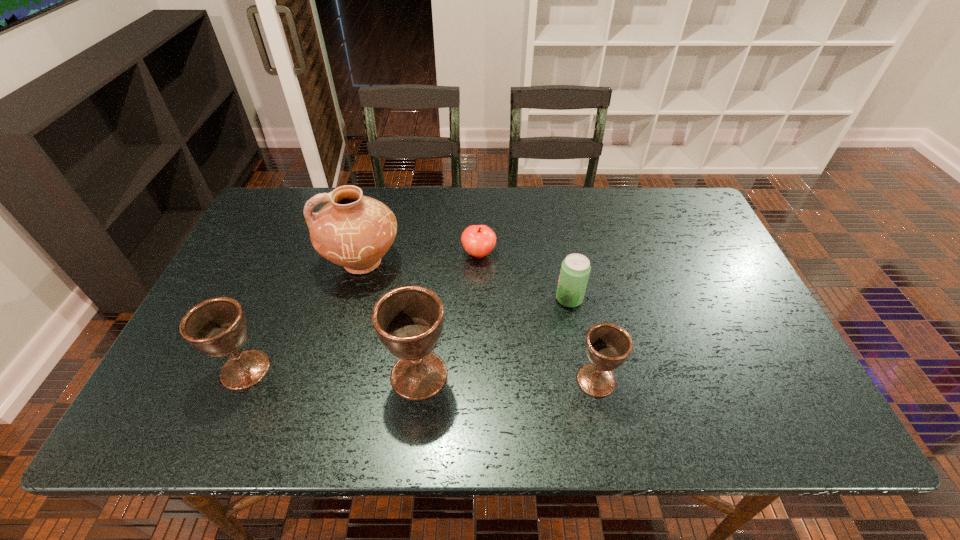
Locate an element on the screen. The image size is (960, 540). the leftmost object is located at coordinates (217, 327).

Where is `the leftmost chalice`? This screenshot has width=960, height=540. the leftmost chalice is located at coordinates (217, 327).

The height and width of the screenshot is (540, 960). What are the coordinates of `the tallest chalice` in the screenshot? It's located at (409, 320).

At what (x,y) coordinates should I click in order to perform the action: click on the third object from left to right. Please return your answer as a coordinate pair (x, y). Looking at the image, I should click on tap(409, 320).

Find the location of a particular element. the shortest chalice is located at coordinates (607, 345).

At what (x,y) coordinates should I click in order to perform the action: click on the fourth object from left to right. Please return your answer as a coordinate pair (x, y). This screenshot has height=540, width=960. Looking at the image, I should click on tap(478, 240).

Locate an element on the screen. the shortest object is located at coordinates (478, 240).

This screenshot has width=960, height=540. Find the location of `pottery`. pottery is located at coordinates click(x=354, y=231).

Where is `soda`? soda is located at coordinates (575, 270).

Where is `vacant space positioned on the back of the leftmost chalice`? The width and height of the screenshot is (960, 540). vacant space positioned on the back of the leftmost chalice is located at coordinates (301, 238).